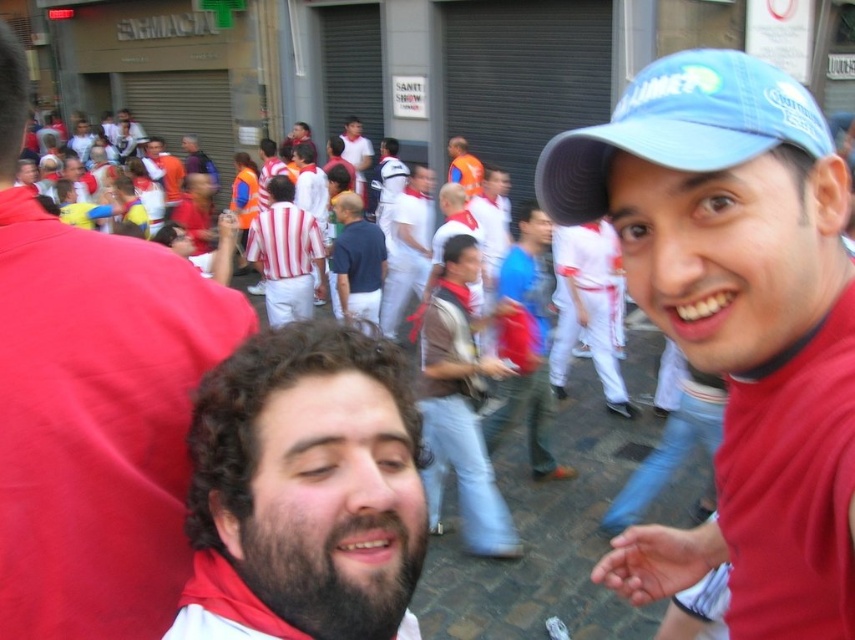
Question: Which point is farther to the camera?

Choices:
 (A) (367, 262)
 (B) (794, 429)
 (C) (360, 474)

Answer: (A)

Question: Is matte red shirt at center above striped fabric shirt at center?

Choices:
 (A) yes
 (B) no

Answer: (B)

Question: Considering the real-world distances, which object is farthest from the orange reflective vest at center?

Choices:
 (A) blue fabric cap at upper right
 (B) white striped shirt at center
 (C) matte red shirt at center
 (D) blue fabric cap at center

Answer: (A)

Question: Estimate the real-world distances between objects in this image. Which object is farther from the striped fabric shirt at center?

Choices:
 (A) brown leather jacket at center
 (B) orange reflective vest at center
 (C) blue fabric cap at center

Answer: (C)

Question: Does blue fabric cap at center appear on the right side of blue fabric cap at upper right?

Choices:
 (A) yes
 (B) no

Answer: (A)

Question: Observing the image, what is the correct spatial positioning of blue fabric cap at center in reference to brown leather jacket at center?

Choices:
 (A) right
 (B) left

Answer: (A)